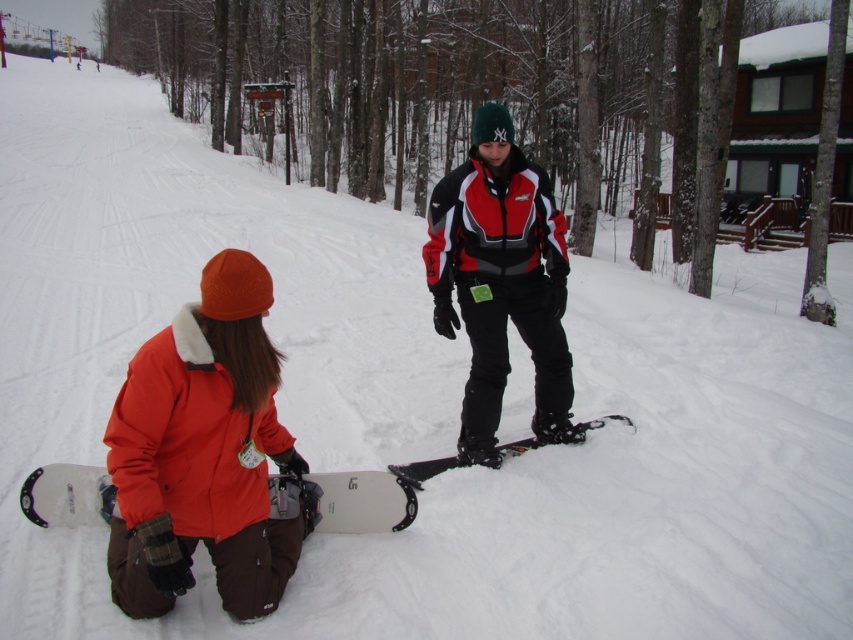
You are a drone operator trying to capture a photo of the white matte snowboard at lower left. The camera is positioned at the center of the image. Which direction should you move the drone to get the snowboard into the frame?

The white matte snowboard at lower left is located at point 0.784 on the x and 0.427 on the y. Since the camera is at the center, you should move the drone to the right and up to center the snowboard.

You are a photographer trying to capture both the orange fleece jacket at lower left and the white matte snowboard at lower left in a single shot. Given their sizes, which object should you focus on to ensure both fit in the frame without zooming in or out?

The orange fleece jacket at lower left is bigger than the white matte snowboard at lower left. To ensure both fit in the frame, focus on the orange fleece jacket at lower left since it is larger and requires more space.